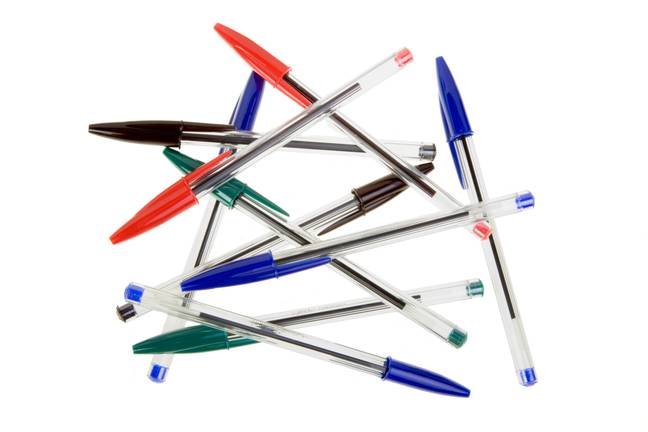
Find the location of a particular element. Image resolution: width=648 pixels, height=432 pixels. black and blue pens is located at coordinates (157, 131), (378, 190), (253, 266), (450, 104), (417, 374), (249, 99).